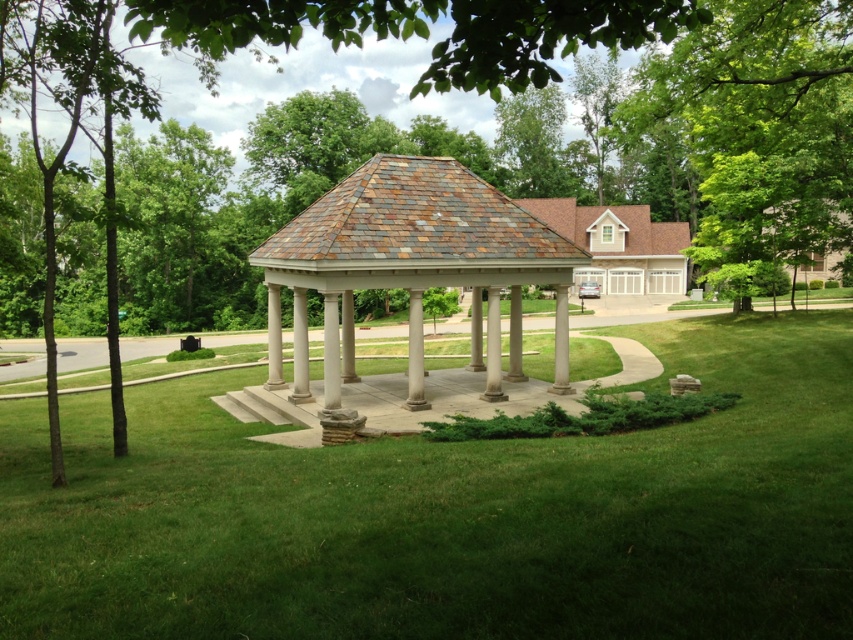
Question: Which object appears closest to the camera in this image?

Choices:
 (A) white stone gazebo at center
 (B) rustic shingles gazebo at center

Answer: (A)

Question: Is white stone gazebo at center further to camera compared to brown shingles gazebo at upper right?

Choices:
 (A) yes
 (B) no

Answer: (B)

Question: Which object is the farthest from the rustic shingles gazebo at center?

Choices:
 (A) brown shingles gazebo at upper right
 (B) white stone gazebo at center

Answer: (A)

Question: Which object is farther from the camera taking this photo?

Choices:
 (A) rustic shingles gazebo at center
 (B) white stone gazebo at center
 (C) brown shingles gazebo at upper right

Answer: (C)

Question: In this image, where is white stone gazebo at center located relative to rustic shingles gazebo at center?

Choices:
 (A) above
 (B) below

Answer: (B)

Question: Is white stone gazebo at center to the right of rustic shingles gazebo at center from the viewer's perspective?

Choices:
 (A) yes
 (B) no

Answer: (A)